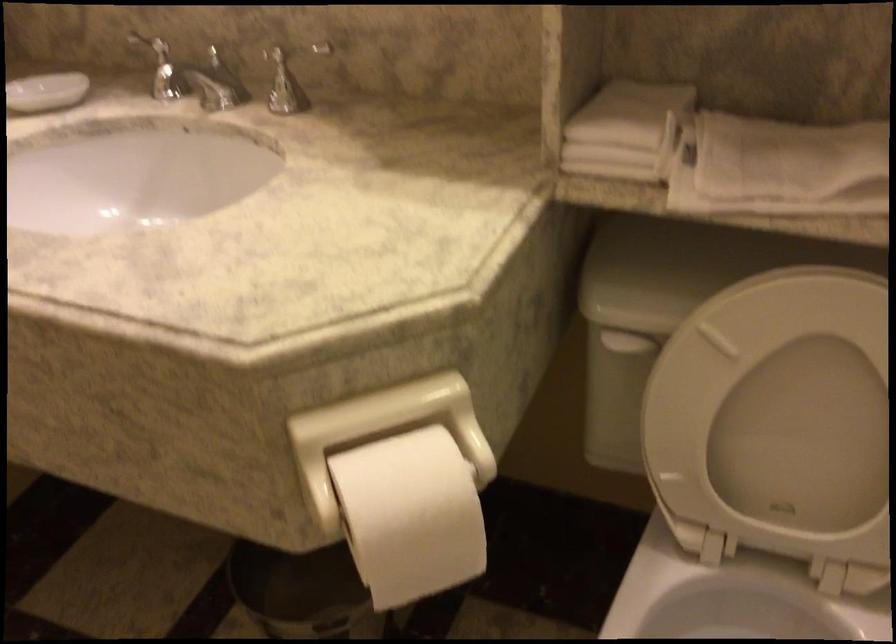
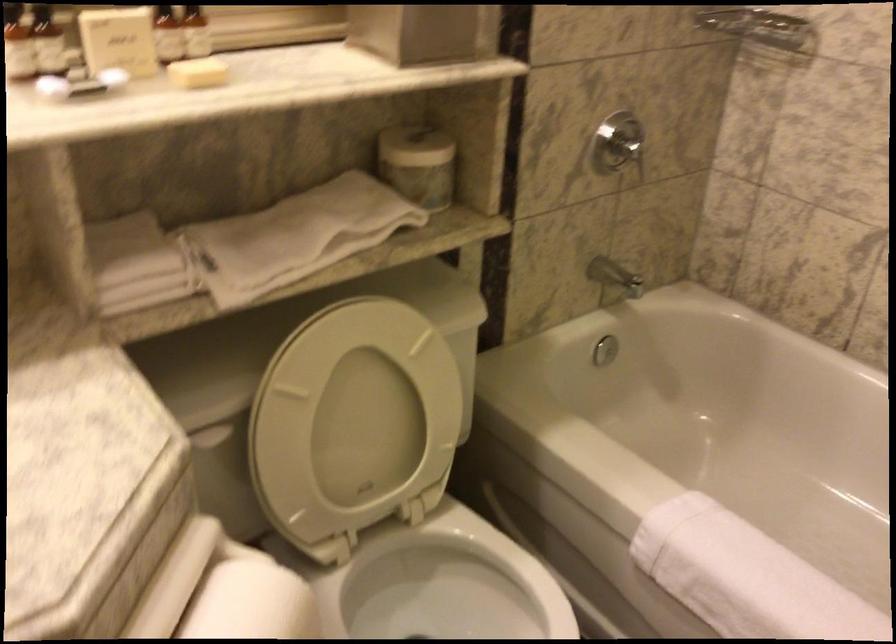
Question: The camera is either moving clockwise (left) or counter-clockwise (right) around the object. The first image is from the beginning of the video and the second image is from the end. Is the camera moving left or right when shooting the video?

Choices:
 (A) Left
 (B) Right

Answer: (A)